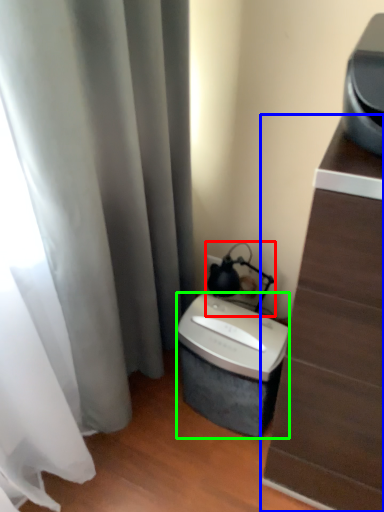
Question: Estimate the real-world distances between objects in this image. Which object is farther from table lamp (highlighted by a red box), furniture (highlighted by a blue box) or appliance (highlighted by a green box)?

Choices:
 (A) furniture
 (B) appliance

Answer: (A)